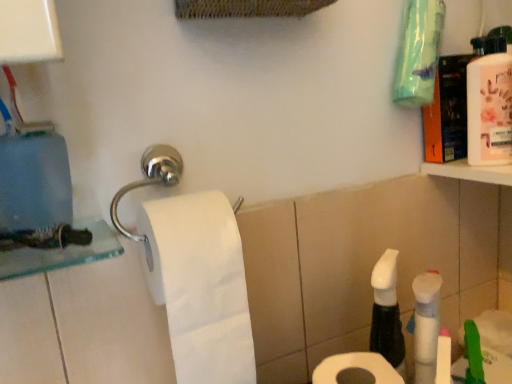
Question: From a real-world perspective, is pink glossy mouthwash at upper right located beneath white matte toilet paper at center, which is the 1th toilet paper in left-to-right order?

Choices:
 (A) yes
 (B) no

Answer: (B)

Question: Considering the relative sizes of pink glossy mouthwash at upper right and white matte toilet paper at center, the 2th toilet paper in the right-to-left sequence, in the image provided, is pink glossy mouthwash at upper right thinner than white matte toilet paper at center, the 2th toilet paper in the right-to-left sequence,?

Choices:
 (A) yes
 (B) no

Answer: (A)

Question: From the image's perspective, is pink glossy mouthwash at upper right above white matte toilet paper at center, which is the 1th toilet paper in left-to-right order?

Choices:
 (A) yes
 (B) no

Answer: (A)

Question: Would you say pink glossy mouthwash at upper right is outside white matte toilet paper at center, which is the 1th toilet paper in left-to-right order?

Choices:
 (A) no
 (B) yes

Answer: (B)

Question: Is the depth of pink glossy mouthwash at upper right greater than that of white matte toilet paper at center, the 2th toilet paper in the right-to-left sequence?

Choices:
 (A) yes
 (B) no

Answer: (A)

Question: Is point 152,256 closer or farther from the camera than point 495,64?

Choices:
 (A) closer
 (B) farther

Answer: (A)

Question: Is white matte toilet paper at center, which is the 1th toilet paper in left-to-right order, inside or outside of pink glossy mouthwash at upper right?

Choices:
 (A) inside
 (B) outside

Answer: (B)

Question: From a real-world perspective, is white matte toilet paper at center, which is the 1th toilet paper in left-to-right order, physically located above or below pink glossy mouthwash at upper right?

Choices:
 (A) above
 (B) below

Answer: (B)

Question: Based on their positions, is white matte toilet paper at center, which is the 1th toilet paper in left-to-right order, located to the left or right of pink glossy mouthwash at upper right?

Choices:
 (A) right
 (B) left

Answer: (B)

Question: From the image's perspective, is pink glossy mouthwash at upper right above or below white matte toilet paper at lower center, which is counted as the 2th toilet paper, starting from the left?

Choices:
 (A) below
 (B) above

Answer: (B)

Question: From a real-world perspective, is pink glossy mouthwash at upper right physically located above or below white matte toilet paper at lower center, which is counted as the 2th toilet paper, starting from the left?

Choices:
 (A) below
 (B) above

Answer: (B)

Question: Considering their positions, is pink glossy mouthwash at upper right located in front of or behind white matte toilet paper at lower center, the first toilet paper viewed from the right?

Choices:
 (A) front
 (B) behind

Answer: (B)

Question: Considering the positions of point (501, 59) and point (338, 379), is point (501, 59) closer or farther from the camera than point (338, 379)?

Choices:
 (A) farther
 (B) closer

Answer: (A)

Question: In terms of width, does pink glossy mouthwash at upper right look wider or thinner when compared to white matte toilet paper at center, the 2th toilet paper in the right-to-left sequence?

Choices:
 (A) wide
 (B) thin

Answer: (B)

Question: Is point (470, 64) positioned closer to the camera than point (181, 336)?

Choices:
 (A) farther
 (B) closer

Answer: (A)